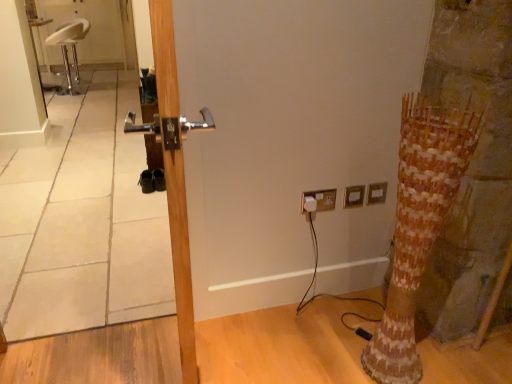
Question: Could white plastic electric outlet at upper right, which is the 1th electric outlet from right to left, be considered to be inside gold metallic electric outlet at upper right, the 2th electric outlet in the left-to-right sequence?

Choices:
 (A) no
 (B) yes

Answer: (A)

Question: Is gold metallic electric outlet at upper right, which is the second electric outlet from right to left, shorter than white plastic electric outlet at upper right, positioned as the 3th electric outlet in left-to-right order?

Choices:
 (A) yes
 (B) no

Answer: (B)

Question: Does gold metallic electric outlet at upper right, the 2th electric outlet in the left-to-right sequence, have a larger size compared to white plastic electric outlet at upper right, which is the 1th electric outlet from right to left?

Choices:
 (A) no
 (B) yes

Answer: (B)

Question: Are gold metallic electric outlet at upper right, the 2th electric outlet in the left-to-right sequence, and white plastic electric outlet at upper right, which is the 1th electric outlet from right to left, located far from each other?

Choices:
 (A) yes
 (B) no

Answer: (B)

Question: Is gold metallic electric outlet at upper right, the 2th electric outlet in the left-to-right sequence, further to the viewer compared to white plastic electric outlet at upper right, which is the 1th electric outlet from right to left?

Choices:
 (A) yes
 (B) no

Answer: (B)

Question: Does point (183, 319) appear closer or farther from the camera than point (434, 160)?

Choices:
 (A) farther
 (B) closer

Answer: (B)

Question: From a real-world perspective, relative to wooden textured tree trunk at right, is wooden door at center vertically above or below?

Choices:
 (A) above
 (B) below

Answer: (A)

Question: Is wooden door at center bigger or smaller than wooden textured tree trunk at right?

Choices:
 (A) big
 (B) small

Answer: (A)

Question: Looking at their shapes, would you say wooden door at center is wider or thinner than wooden textured tree trunk at right?

Choices:
 (A) thin
 (B) wide

Answer: (A)

Question: Is wooden textured tree trunk at right inside the boundaries of white plastic socket at upper right, which is counted as the 1th electric outlet, starting from the left, or outside?

Choices:
 (A) outside
 (B) inside

Answer: (A)

Question: In terms of height, does wooden textured tree trunk at right look taller or shorter compared to white plastic socket at upper right, which is counted as the 1th electric outlet, starting from the left?

Choices:
 (A) short
 (B) tall

Answer: (B)

Question: In terms of size, does wooden textured tree trunk at right appear bigger or smaller than white plastic socket at upper right, the third electric outlet from the right?

Choices:
 (A) small
 (B) big

Answer: (B)

Question: From a real-world perspective, is wooden textured tree trunk at right positioned above or below white plastic socket at upper right, which is counted as the 1th electric outlet, starting from the left?

Choices:
 (A) below
 (B) above

Answer: (B)

Question: Considering the positions of metallic silver mirror at left and white plastic electric outlet at upper right, which is the 1th electric outlet from right to left, in the image, is metallic silver mirror at left wider or thinner than white plastic electric outlet at upper right, which is the 1th electric outlet from right to left,?

Choices:
 (A) wide
 (B) thin

Answer: (A)

Question: Based on their sizes in the image, would you say metallic silver mirror at left is bigger or smaller than white plastic electric outlet at upper right, positioned as the 3th electric outlet in left-to-right order?

Choices:
 (A) big
 (B) small

Answer: (A)